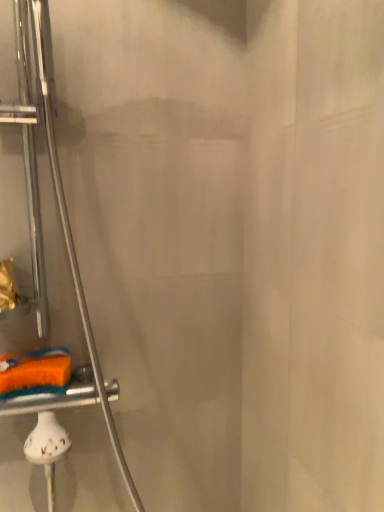
Describe the element at coordinates (35, 373) in the screenshot. Image resolution: width=384 pixels, height=512 pixels. I see `orange terry cloth towel at lower left` at that location.

Where is `orange terry cloth towel at lower left`? orange terry cloth towel at lower left is located at coordinates (35, 373).

Image resolution: width=384 pixels, height=512 pixels. Find the location of `orange terry cloth towel at lower left`. orange terry cloth towel at lower left is located at coordinates (35, 373).